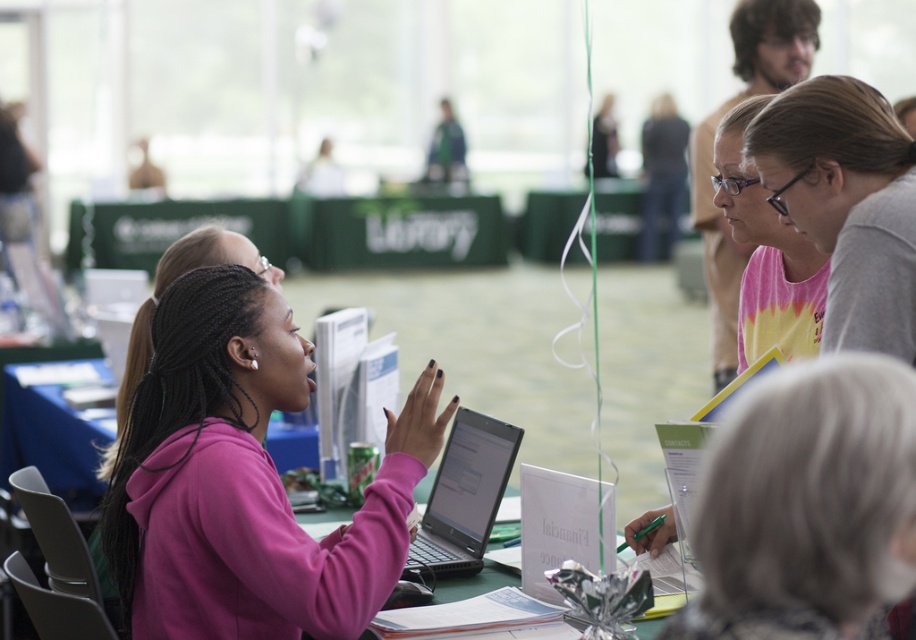
Question: Which object appears farthest from the camera in this image?

Choices:
 (A) tie-dye fabric shirt at upper right
 (B) pink matte laptop at center
 (C) black glossy laptop at center
 (D) gray fabric at center

Answer: (C)

Question: Does pink matte laptop at center have a lesser width compared to tie-dye fabric shirt at upper right?

Choices:
 (A) no
 (B) yes

Answer: (A)

Question: Where is tie-dye fabric shirt at upper right located in relation to black glossy laptop at center in the image?

Choices:
 (A) below
 (B) above

Answer: (B)

Question: Does pink matte laptop at center have a greater width compared to black glossy laptop at center?

Choices:
 (A) no
 (B) yes

Answer: (B)

Question: Which point is farther to the camera?

Choices:
 (A) black glossy laptop at center
 (B) tie-dye fabric shirt at upper right
 (C) pink matte laptop at center
 (D) gray fabric at center

Answer: (A)

Question: Estimate the real-world distances between objects in this image. Which object is closer to the black glossy laptop at center?

Choices:
 (A) pink matte laptop at center
 (B) pink tie-dye shirt at upper right

Answer: (A)